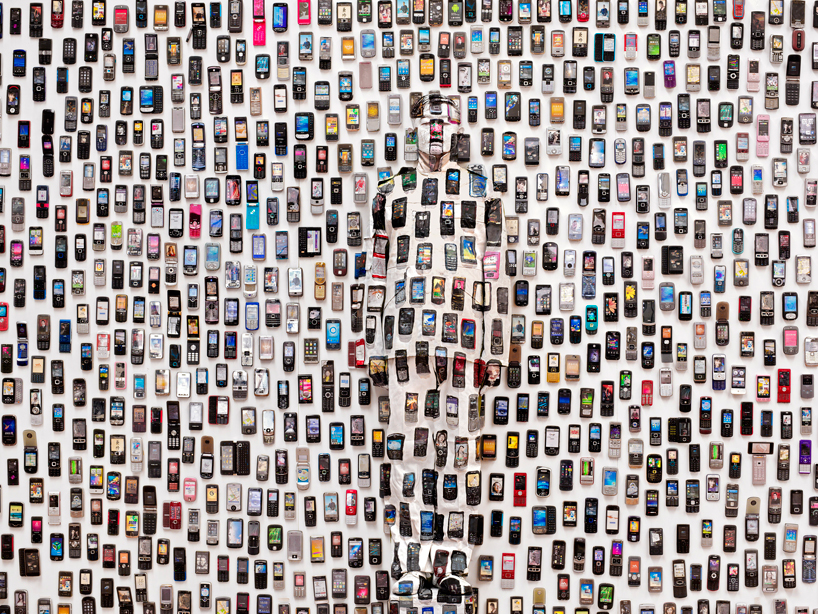
Where is `phone`? The width and height of the screenshot is (818, 614). phone is located at coordinates (731, 581).